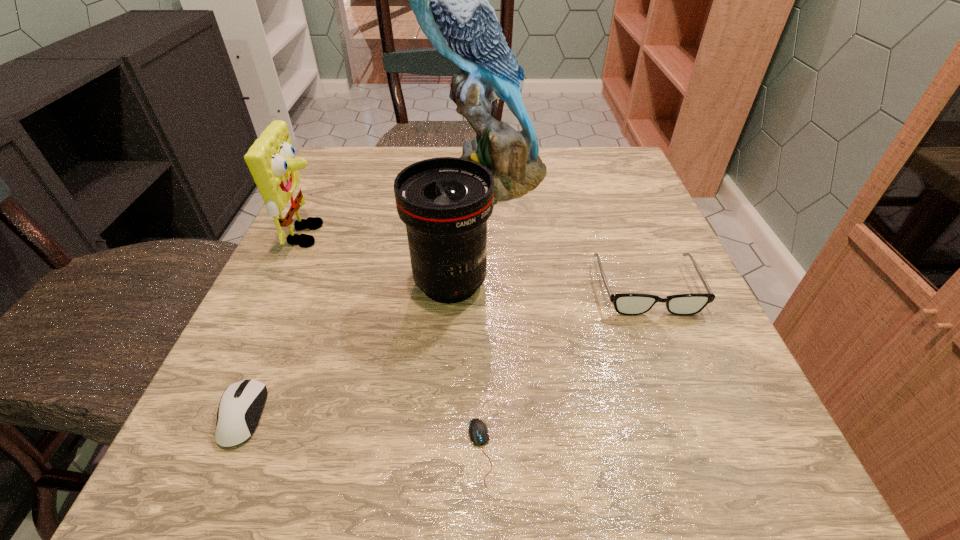
You are a GUI agent. You are given a task and a screenshot of the screen. Output one action in this format:
    pyautogui.click(x=<x>, y=<y>)
    Task: Click on the mouse that is positioned at the left edge
    
    Given the screenshot: What is the action you would take?
    pyautogui.click(x=241, y=404)

At what (x,y) coordinates should I click in order to perform the action: click on object positioned at the right edge. Please return your answer as a coordinate pair (x, y). Looking at the image, I should click on (630, 304).

The image size is (960, 540). I want to click on object that is positioned at the near left corner, so click(x=241, y=404).

This screenshot has width=960, height=540. In order to click on vacant region at the near edge of the desktop in this screenshot , I will do `click(536, 466)`.

The image size is (960, 540). I want to click on free region at the left edge, so click(x=346, y=249).

Where is `free region at the right edge`? free region at the right edge is located at coordinates (626, 364).

You are a GUI agent. You are given a task and a screenshot of the screen. Output one action in this format:
    pyautogui.click(x=<x>, y=<y>)
    Task: Click on the vacant space at the far left corner
    
    Given the screenshot: What is the action you would take?
    pyautogui.click(x=366, y=147)

You are a GUI agent. You are given a task and a screenshot of the screen. Output one action in this format:
    pyautogui.click(x=<x>, y=<y>)
    Task: Click on the free location at the far right corner
    The height and width of the screenshot is (540, 960).
    Given the screenshot: What is the action you would take?
    pyautogui.click(x=574, y=154)

Image resolution: width=960 pixels, height=540 pixels. Find the location of `vacant space at the near right corner`. vacant space at the near right corner is located at coordinates (700, 457).

Identify the location of blank region between the left mouse and the rightmost object. The width and height of the screenshot is (960, 540). (444, 352).